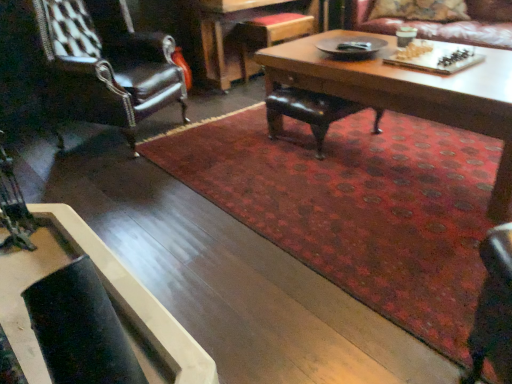
Question: Would you say leather armchair at left, which ranks as the 1th chair in left-to-right order, is to the left or to the right of leather at center, which is the first chair in right-to-left order, in the picture?

Choices:
 (A) right
 (B) left

Answer: (B)

Question: Considering their positions, is leather armchair at left, which ranks as the 1th chair in left-to-right order, located in front of or behind leather at center, which is the second chair in left-to-right order?

Choices:
 (A) behind
 (B) front

Answer: (B)

Question: Which is farther from the leather armchair at left, acting as the second chair starting from the right?

Choices:
 (A) wooden coffee table at center, arranged as the 1th coffee table when viewed from the top
 (B) leather at center, which is the first chair in right-to-left order
 (C) matte brown cup at upper right
 (D) velvet floral pillow at upper right
 (E) leather couch at upper right

Answer: (D)

Question: Which is nearer to the wooden table at center?

Choices:
 (A) leather armchair at left, which ranks as the 1th chair in left-to-right order
 (B) wooden coffee table at center, which is the 2th coffee table from left to right
 (C) leather at center, which is the second chair in left-to-right order
 (D) leather couch at upper right
 (E) velvet floral pillow at upper right

Answer: (D)